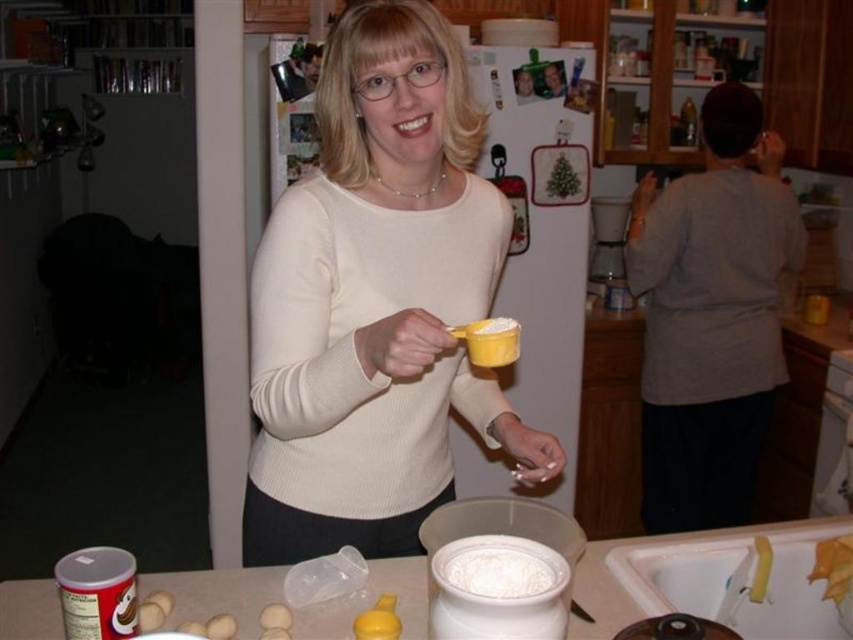
Question: Which object is closer to the camera taking this photo?

Choices:
 (A) white matte sweater at center
 (B) gray cotton shirt at upper right
 (C) white plastic sink at lower right
 (D) yellow matte eggs at center

Answer: (A)

Question: Is white matte sweater at center wider than yellow matte eggs at center?

Choices:
 (A) no
 (B) yes

Answer: (B)

Question: Can you confirm if white matte sweater at center is positioned to the right of gray cotton shirt at upper right?

Choices:
 (A) yes
 (B) no

Answer: (B)

Question: Is white plastic sink at lower right in front of yellow matte eggs at center?

Choices:
 (A) yes
 (B) no

Answer: (B)

Question: Estimate the real-world distances between objects in this image. Which object is farther from the white plastic sink at lower right?

Choices:
 (A) gray cotton shirt at upper right
 (B) yellow matte eggs at center

Answer: (A)

Question: Which point is closer to the camera taking this photo?

Choices:
 (A) (451, 573)
 (B) (285, 620)
 (C) (735, 563)
 (D) (354, 168)

Answer: (A)